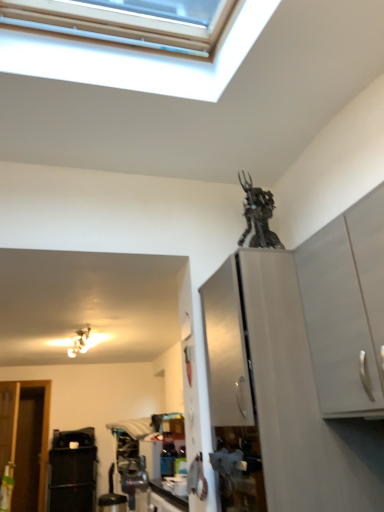
The width and height of the screenshot is (384, 512). What do you see at coordinates (346, 308) in the screenshot? I see `white matte cabinet at upper right, arranged as the 1th cabinetry when viewed from the front` at bounding box center [346, 308].

Looking at this image, in order to face satin white cabinet at upper right, marked as the first cabinetry in a back-to-front arrangement, should I rotate leftwards or rightwards?

A 11.091 degree turn to the right will do.

I want to click on metallic statue at upper center, so click(258, 216).

You are a GUI agent. You are given a task and a screenshot of the screen. Output one action in this format:
    pyautogui.click(x=<x>, y=<y>)
    Task: Click on the metallic silver light fixture at upper left
    
    Given the screenshot: What is the action you would take?
    pyautogui.click(x=80, y=342)

From a real-world perspective, is satin white cabinet at upper right, the second cabinetry positioned from the front, physically located above or below metallic silver light fixture at upper left?

satin white cabinet at upper right, the second cabinetry positioned from the front, is situated lower than metallic silver light fixture at upper left in the real world.

Between satin white cabinet at upper right, marked as the first cabinetry in a back-to-front arrangement, and metallic silver light fixture at upper left, which one is positioned in front?

satin white cabinet at upper right, marked as the first cabinetry in a back-to-front arrangement, is more forward.

Is satin white cabinet at upper right, marked as the first cabinetry in a back-to-front arrangement, oriented away from metallic silver light fixture at upper left?

No, satin white cabinet at upper right, marked as the first cabinetry in a back-to-front arrangement, is not facing away from metallic silver light fixture at upper left.

Is point (322, 463) farther from camera compared to point (84, 351)?

No, (322, 463) is closer to viewer.

Is black plastic trash can at lower left turned away from satin white cabinet at upper right, marked as the first cabinetry in a back-to-front arrangement?

No, black plastic trash can at lower left is not facing away from satin white cabinet at upper right, marked as the first cabinetry in a back-to-front arrangement.

Which object is wider, black plastic trash can at lower left or satin white cabinet at upper right, marked as the first cabinetry in a back-to-front arrangement?

satin white cabinet at upper right, marked as the first cabinetry in a back-to-front arrangement, is wider.

Is black plastic trash can at lower left behind satin white cabinet at upper right, marked as the first cabinetry in a back-to-front arrangement?

Yes, it is.

Can you confirm if black plastic trash can at lower left is smaller than satin white cabinet at upper right, the second cabinetry positioned from the front?

Result: Yes.

Is the position of white matte cabinet at upper right, arranged as the 1th cabinetry when viewed from the front, more distant than that of satin white cabinet at upper right, marked as the first cabinetry in a back-to-front arrangement?

No, white matte cabinet at upper right, arranged as the 1th cabinetry when viewed from the front, is in front of satin white cabinet at upper right, marked as the first cabinetry in a back-to-front arrangement.

What are the coordinates of `cabinetry that is above the satin white cabinet at upper right, the second cabinetry positioned from the front (from the image's perspective)` in the screenshot? It's located at (346, 308).

Which is more to the left, white matte cabinet at upper right, which is the 2th cabinetry in back-to-front order, or satin white cabinet at upper right, the second cabinetry positioned from the front?

Positioned to the left is satin white cabinet at upper right, the second cabinetry positioned from the front.

From the image's perspective, which one is positioned lower, white matte cabinet at upper right, arranged as the 1th cabinetry when viewed from the front, or satin white cabinet at upper right, the second cabinetry positioned from the front?

satin white cabinet at upper right, the second cabinetry positioned from the front.

Considering the sizes of satin white cabinet at upper right, the second cabinetry positioned from the front, and black plastic trash can at lower left in the image, is satin white cabinet at upper right, the second cabinetry positioned from the front, wider or thinner than black plastic trash can at lower left?

Clearly, satin white cabinet at upper right, the second cabinetry positioned from the front, has more width compared to black plastic trash can at lower left.

Is satin white cabinet at upper right, the second cabinetry positioned from the front, touching black plastic trash can at lower left?

satin white cabinet at upper right, the second cabinetry positioned from the front, and black plastic trash can at lower left are not in contact.

From a real-world perspective, which is physically below, satin white cabinet at upper right, marked as the first cabinetry in a back-to-front arrangement, or black plastic trash can at lower left?

In real-world perspective, black plastic trash can at lower left is lower.

How many degrees apart are the facing directions of satin white cabinet at upper right, the second cabinetry positioned from the front, and black plastic trash can at lower left?

The angle between the facing direction of satin white cabinet at upper right, the second cabinetry positioned from the front, and the facing direction of black plastic trash can at lower left is 87.9 degrees.

At what (x,y) coordinates should I click in order to perform the action: click on appliance below the white matte cabinet at upper right, which is the 2th cabinetry in back-to-front order (from the image's perspective). Please return your answer as a coordinate pair (x, y). The height and width of the screenshot is (512, 384). Looking at the image, I should click on (72, 479).

Looking at their sizes, would you say white matte cabinet at upper right, arranged as the 1th cabinetry when viewed from the front, is wider or thinner than black plastic trash can at lower left?

In the image, white matte cabinet at upper right, arranged as the 1th cabinetry when viewed from the front, appears to be more narrow than black plastic trash can at lower left.

Are white matte cabinet at upper right, arranged as the 1th cabinetry when viewed from the front, and black plastic trash can at lower left beside each other?

A: white matte cabinet at upper right, arranged as the 1th cabinetry when viewed from the front, and black plastic trash can at lower left are not in contact.

How different are the orientations of white matte cabinet at upper right, which is the 2th cabinetry in back-to-front order, and black plastic trash can at lower left in degrees?

The angular difference between white matte cabinet at upper right, which is the 2th cabinetry in back-to-front order, and black plastic trash can at lower left is 88.2 degrees.

Between satin white cabinet at upper right, marked as the first cabinetry in a back-to-front arrangement, and metallic statue at upper center, which one has larger width?

satin white cabinet at upper right, marked as the first cabinetry in a back-to-front arrangement, is wider.

Is satin white cabinet at upper right, marked as the first cabinetry in a back-to-front arrangement, positioned far away from metallic statue at upper center?

Actually, satin white cabinet at upper right, marked as the first cabinetry in a back-to-front arrangement, and metallic statue at upper center are a little close together.

This screenshot has width=384, height=512. What are the coordinates of `sculpture to the left of satin white cabinet at upper right, the second cabinetry positioned from the front` in the screenshot? It's located at (258, 216).

Which is less distant, (283, 396) or (264, 246)?

The point (283, 396) is closer.

Looking at the image, does metallic silver light fixture at upper left seem bigger or smaller compared to black plastic trash can at lower left?

metallic silver light fixture at upper left is smaller than black plastic trash can at lower left.

Is black plastic trash can at lower left at the back of metallic silver light fixture at upper left?

No, metallic silver light fixture at upper left is not facing the opposite direction of black plastic trash can at lower left.

From a real-world perspective, is metallic silver light fixture at upper left beneath black plastic trash can at lower left?

No, from a real-world perspective, metallic silver light fixture at upper left is not under black plastic trash can at lower left.

Where is `appliance below the metallic silver light fixture at upper left (from a real-world perspective)`? appliance below the metallic silver light fixture at upper left (from a real-world perspective) is located at coordinates (72, 479).

Starting from the metallic silver light fixture at upper left, which cabinetry is the 1st one to the right? Please provide its 2D coordinates.

[(282, 390)]

At what (x,y) coordinates should I click in order to perform the action: click on the 1st cabinetry above the black plastic trash can at lower left (from a real-world perspective). Please return your answer as a coordinate pair (x, y). Image resolution: width=384 pixels, height=512 pixels. Looking at the image, I should click on (282, 390).

From the image, which object appears to be nearer to satin white cabinet at upper right, marked as the first cabinetry in a back-to-front arrangement, white matte cabinet at upper right, which is the 2th cabinetry in back-to-front order, or black plastic trash can at lower left?

The object closer to satin white cabinet at upper right, marked as the first cabinetry in a back-to-front arrangement, is white matte cabinet at upper right, which is the 2th cabinetry in back-to-front order.

Looking at the image, which one is located further to white matte cabinet at upper right, which is the 2th cabinetry in back-to-front order, metallic silver light fixture at upper left or black plastic trash can at lower left?

black plastic trash can at lower left is further to white matte cabinet at upper right, which is the 2th cabinetry in back-to-front order.

Looking at the image, which one is located further to metallic statue at upper center, satin white cabinet at upper right, the second cabinetry positioned from the front, or white matte cabinet at upper right, arranged as the 1th cabinetry when viewed from the front?

satin white cabinet at upper right, the second cabinetry positioned from the front, is further to metallic statue at upper center.

When comparing their distances from metallic silver light fixture at upper left, does white matte cabinet at upper right, arranged as the 1th cabinetry when viewed from the front, or metallic statue at upper center seem closer?

→ metallic statue at upper center lies closer to metallic silver light fixture at upper left than the other object.

Looking at the image, which one is located closer to satin white cabinet at upper right, the second cabinetry positioned from the front, black plastic trash can at lower left or white matte cabinet at upper right, which is the 2th cabinetry in back-to-front order?

Based on the image, white matte cabinet at upper right, which is the 2th cabinetry in back-to-front order, appears to be nearer to satin white cabinet at upper right, the second cabinetry positioned from the front.

When comparing their distances from black plastic trash can at lower left, does metallic silver light fixture at upper left or metallic statue at upper center seem further?

metallic statue at upper center is further to black plastic trash can at lower left.

Estimate the real-world distances between objects in this image. Which object is closer to black plastic trash can at lower left, metallic statue at upper center or white matte cabinet at upper right, arranged as the 1th cabinetry when viewed from the front?

metallic statue at upper center is closer to black plastic trash can at lower left.

Estimate the real-world distances between objects in this image. Which object is further from white matte cabinet at upper right, which is the 2th cabinetry in back-to-front order, black plastic trash can at lower left or satin white cabinet at upper right, the second cabinetry positioned from the front?

black plastic trash can at lower left lies further to white matte cabinet at upper right, which is the 2th cabinetry in back-to-front order, than the other object.

In order to click on sculpture between white matte cabinet at upper right, which is the 2th cabinetry in back-to-front order, and black plastic trash can at lower left from front to back in this screenshot , I will do `click(258, 216)`.

The image size is (384, 512). I want to click on light fixture between satin white cabinet at upper right, marked as the first cabinetry in a back-to-front arrangement, and black plastic trash can at lower left, along the z-axis, so click(x=80, y=342).

I want to click on sculpture between satin white cabinet at upper right, marked as the first cabinetry in a back-to-front arrangement, and black plastic trash can at lower left in the front-back direction, so click(258, 216).

The width and height of the screenshot is (384, 512). I want to click on sculpture between white matte cabinet at upper right, which is the 2th cabinetry in back-to-front order, and metallic silver light fixture at upper left, along the z-axis, so click(258, 216).